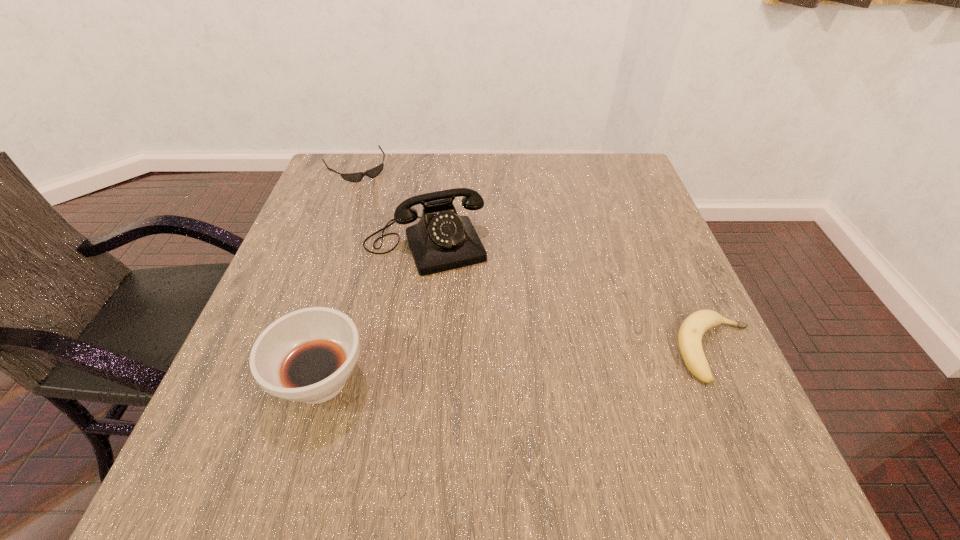
You are a GUI agent. You are given a task and a screenshot of the screen. Output one action in this format:
    pyautogui.click(x=<x>, y=<y>)
    Task: Click on the free space located on the front-facing side of the shortest object
    
    Given the screenshot: What is the action you would take?
    pyautogui.click(x=389, y=219)

What are the coordinates of `vacant space situated on the front-facing side of the shortest object` in the screenshot? It's located at (374, 196).

Where is `vacant area situated on the front face of the telephone`? vacant area situated on the front face of the telephone is located at coordinates (468, 341).

This screenshot has height=540, width=960. Find the location of `free point located 0.160m on the front face of the telephone`. free point located 0.160m on the front face of the telephone is located at coordinates point(463,329).

Locate an element on the screen. This screenshot has height=540, width=960. blank space located 0.150m on the front face of the telephone is located at coordinates (461, 326).

This screenshot has height=540, width=960. Identify the location of object that is at the far edge. (372, 173).

Image resolution: width=960 pixels, height=540 pixels. Identify the location of soup bowl at the near edge. (307, 355).

This screenshot has height=540, width=960. I want to click on banana that is at the near edge, so click(692, 329).

You are a GUI agent. You are given a task and a screenshot of the screen. Output one action in this format:
    pyautogui.click(x=<x>, y=<y>)
    Task: Click on the soup bowl located at the left edge
    
    Given the screenshot: What is the action you would take?
    pyautogui.click(x=307, y=355)

This screenshot has width=960, height=540. Identify the location of sunglasses present at the left edge. (372, 173).